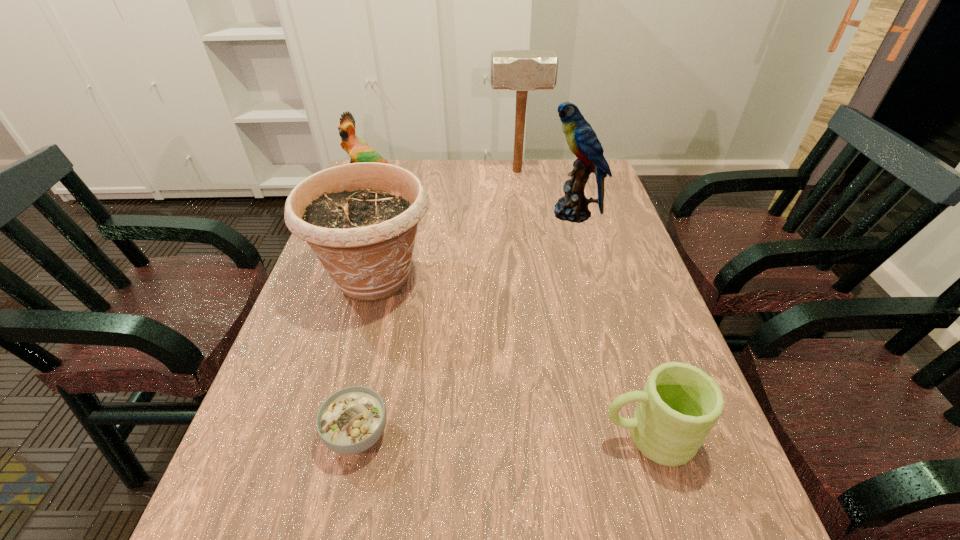
The width and height of the screenshot is (960, 540). Identify the location of parrot situated at the far edge. (359, 151).

At what (x,y) coordinates should I click in order to perform the action: click on parrot at the left edge. Please return your answer as a coordinate pair (x, y). Image resolution: width=960 pixels, height=540 pixels. Looking at the image, I should click on (359, 151).

The image size is (960, 540). What are the coordinates of `flowerpot that is at the left edge` in the screenshot? It's located at (360, 219).

The image size is (960, 540). Identify the location of soup bowl present at the left edge. (350, 421).

The image size is (960, 540). In order to click on parrot present at the right edge in this screenshot , I will do `click(582, 140)`.

Image resolution: width=960 pixels, height=540 pixels. What are the coordinates of `mug that is at the right edge` in the screenshot? It's located at (680, 403).

Locate an element on the screen. object at the far left corner is located at coordinates (359, 151).

This screenshot has height=540, width=960. Find the location of `free space at the far edge`. free space at the far edge is located at coordinates (500, 187).

Locate an element on the screen. The height and width of the screenshot is (540, 960). vacant region at the left edge of the desktop is located at coordinates (238, 488).

Locate an element on the screen. This screenshot has height=540, width=960. free region at the right edge of the desktop is located at coordinates (599, 282).